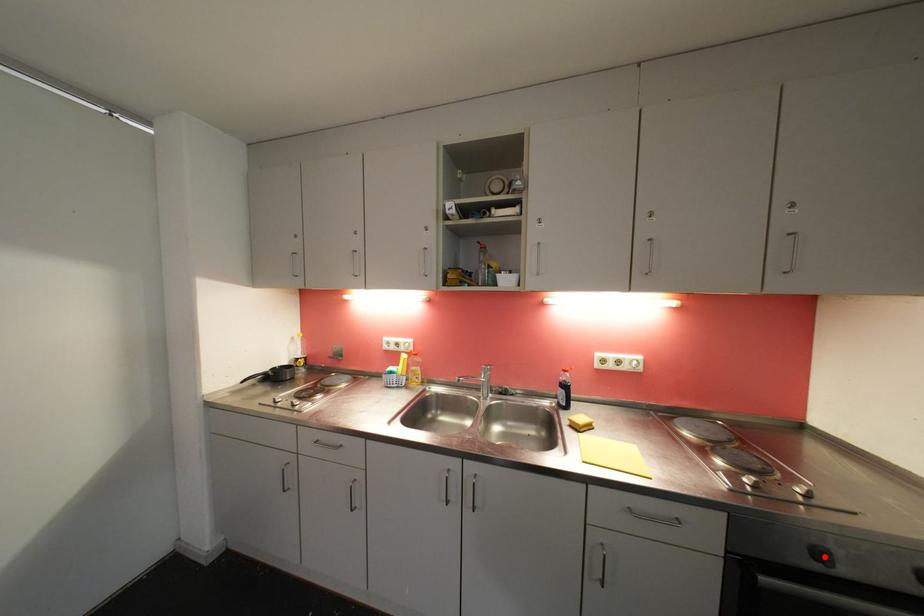
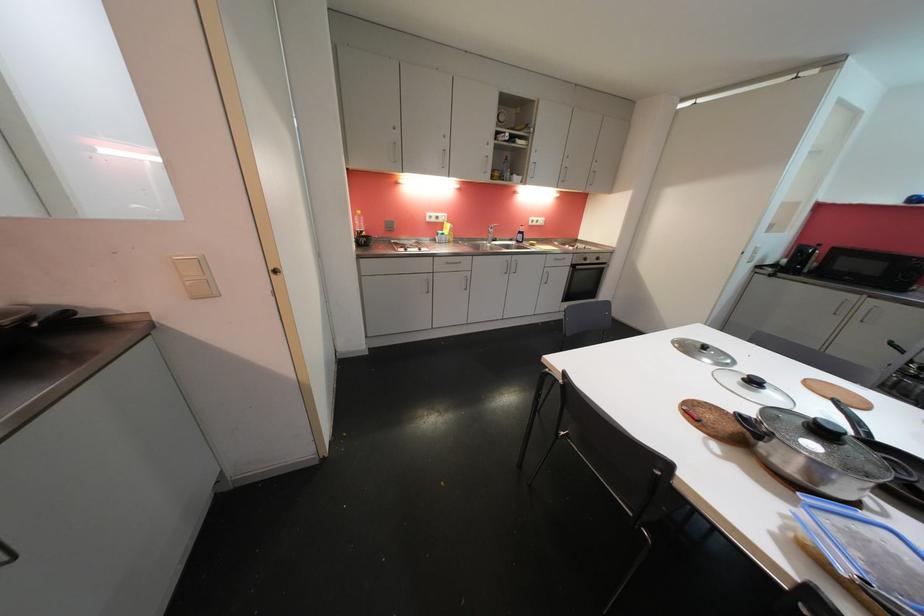
The point at the highlighted location is marked in the first image. Where is the corresponding point in the second image?

(590, 262)